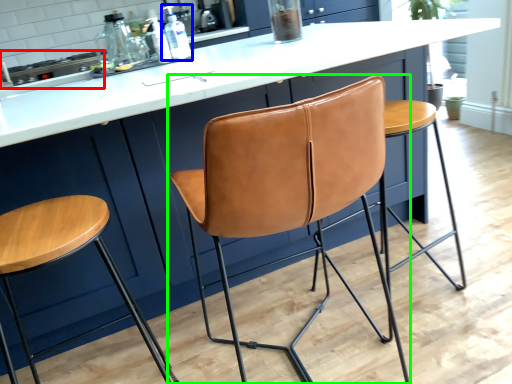
Question: Based on their relative distances, which object is farther from appliance (highlighted by a red box)? Choose from bottle (highlighted by a blue box) and chair (highlighted by a green box).

Choices:
 (A) bottle
 (B) chair

Answer: (B)